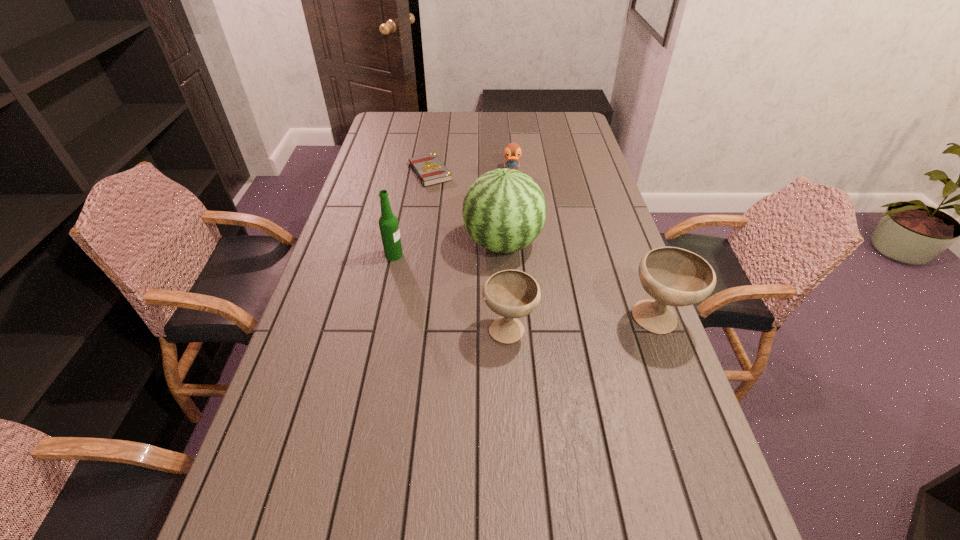
Image resolution: width=960 pixels, height=540 pixels. Identify the location of free space between the duck and the fifth shortest object. (453, 213).

At what (x,y) coordinates should I click in order to perform the action: click on free space between the tallest object and the third tallest object. Please return your answer as a coordinate pair (x, y). Image resolution: width=960 pixels, height=540 pixels. Looking at the image, I should click on (580, 282).

Where is `free spot between the watermelon and the beer bottle`? free spot between the watermelon and the beer bottle is located at coordinates (448, 249).

This screenshot has height=540, width=960. I want to click on free space between the shorter chalice and the taller chalice, so click(583, 324).

Identify the location of free space between the shortest object and the rightmost object. The image size is (960, 540). (543, 246).

Find the location of a particular element. This screenshot has height=540, width=960. vacant area between the fifth tallest object and the second tallest object is located at coordinates (453, 213).

The width and height of the screenshot is (960, 540). In order to click on free space between the shorter chalice and the second tallest object in this screenshot , I will do `click(451, 292)`.

At what (x,y) coordinates should I click in order to perform the action: click on object that ranks as the second closest to the tallest object. Please return your answer as a coordinate pair (x, y). This screenshot has width=960, height=540. Looking at the image, I should click on (388, 223).

Identify which object is located as the fifth nearest to the beer bottle. Please provide its 2D coordinates. Your answer should be formatted as a tuple, i.e. [(x, y)], where the tuple contains the x and y coordinates of a point satisfying the conditions above.

[(673, 276)]

Locate an element on the screen. The height and width of the screenshot is (540, 960). vacant space that satisfies the following two spatial constraints: 1. on the label of the beer bottle; 2. on the left side of the shorter chalice is located at coordinates (378, 328).